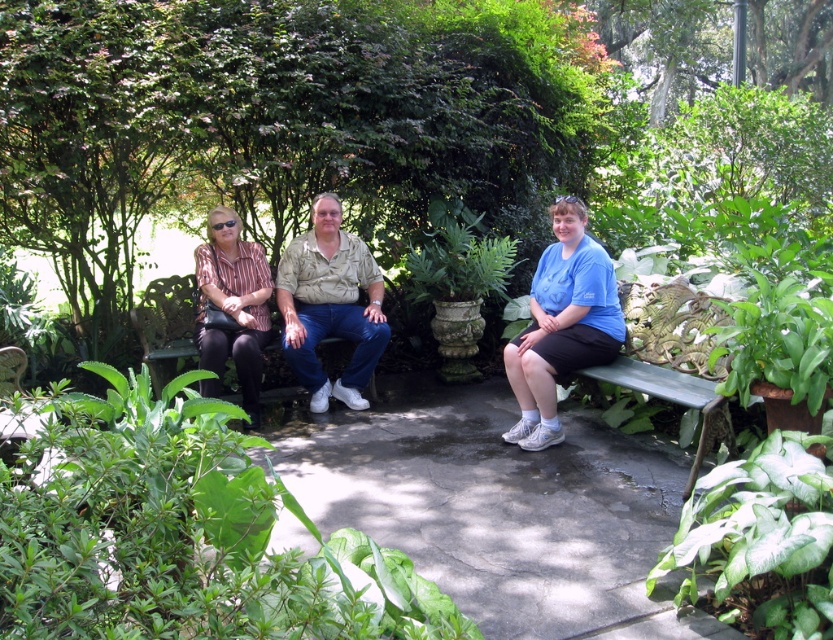
Question: Which object appears closest to the camera in this image?

Choices:
 (A) blue cotton shirt at center
 (B) green metallic bench at lower right
 (C) green leafy plant at center
 (D) striped fabric shirt at left

Answer: (C)

Question: Considering the real-world distances, which object is farthest from the matte khaki shirt at center?

Choices:
 (A) striped fabric shirt at left
 (B) green metallic bench at lower right

Answer: (B)

Question: Does green matte leaf at lower right have a larger size compared to blue cotton shirt at center?

Choices:
 (A) no
 (B) yes

Answer: (A)

Question: Observing the image, what is the correct spatial positioning of green leafy plant at center in reference to matte khaki shirt at center?

Choices:
 (A) above
 (B) below

Answer: (B)

Question: Among these points, which one is nearest to the camera?

Choices:
 (A) (122, 509)
 (B) (257, 401)
 (C) (382, 337)

Answer: (A)

Question: Can you confirm if matte khaki shirt at center is thinner than blue cotton shirt at center?

Choices:
 (A) no
 (B) yes

Answer: (A)